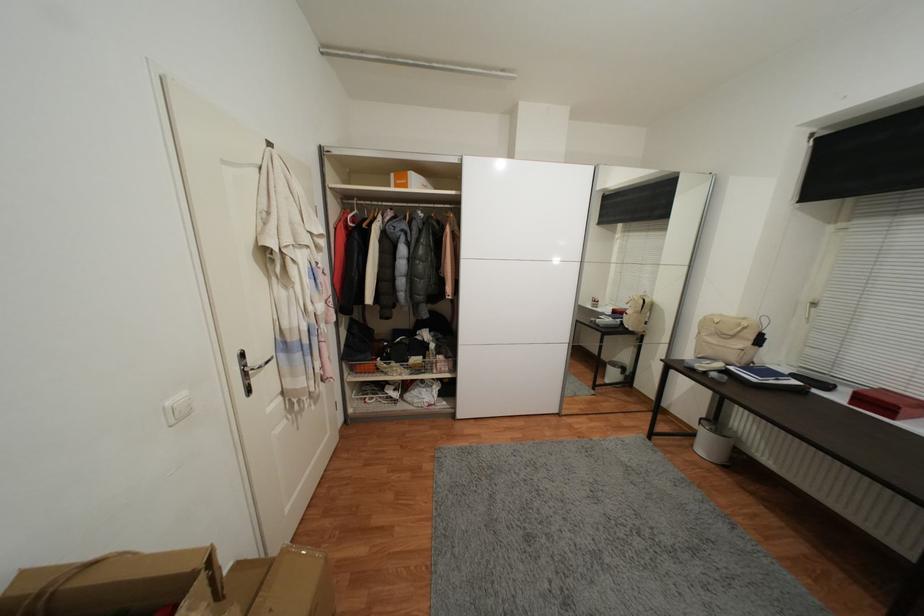
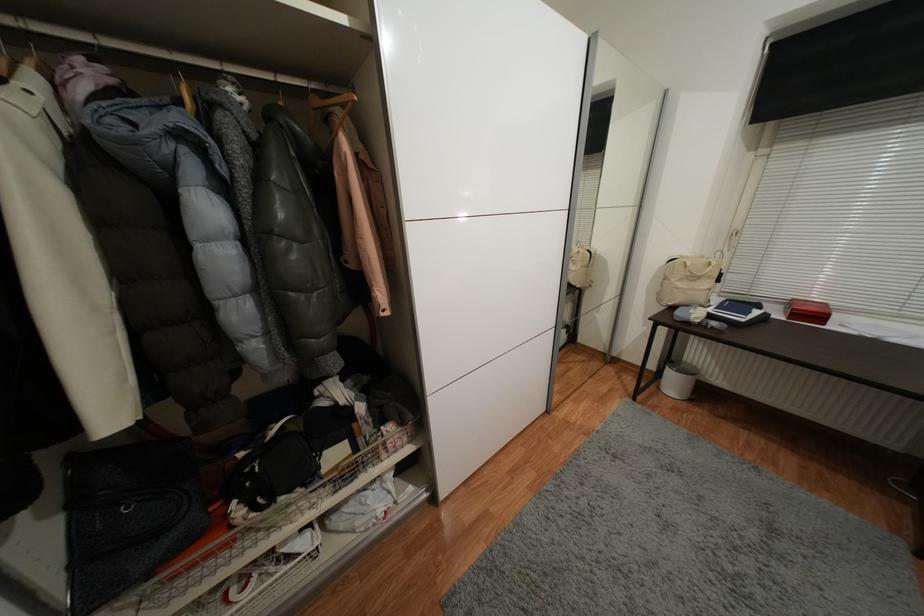
Where in the second image is the point corresponding to (759,381) from the first image?

(747, 321)